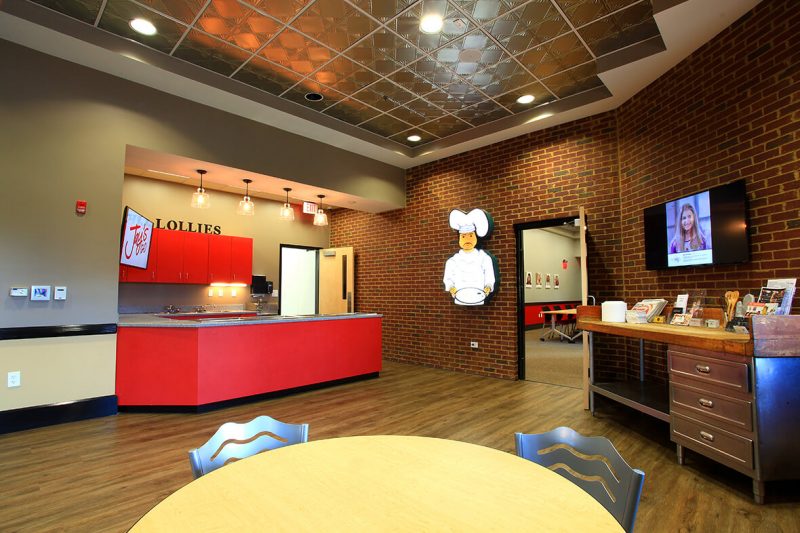
Locate an element on the screen. The height and width of the screenshot is (533, 800). chef cut out wall art is located at coordinates (482, 270).